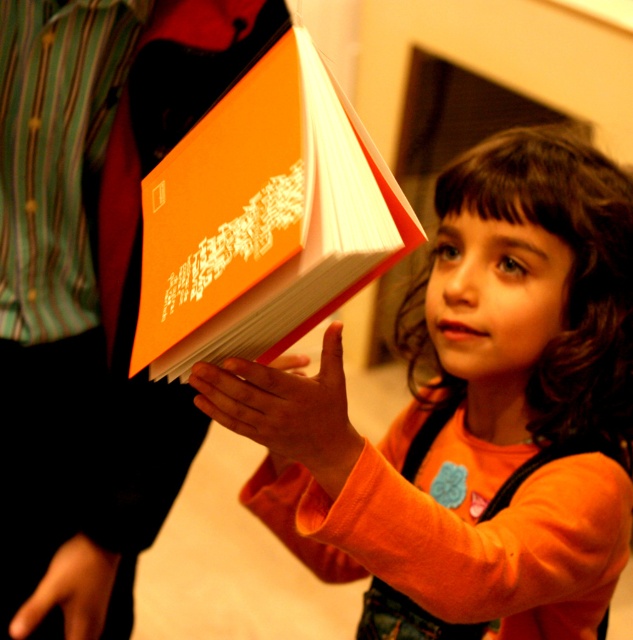
Is matte orange book at center taller than orange matte book at center?

Indeed, matte orange book at center has a greater height compared to orange matte book at center.

Is point (436, 557) positioned behind point (354, 246)?

Yes.

Find the location of a particular element. matte orange book at center is located at coordinates (473, 404).